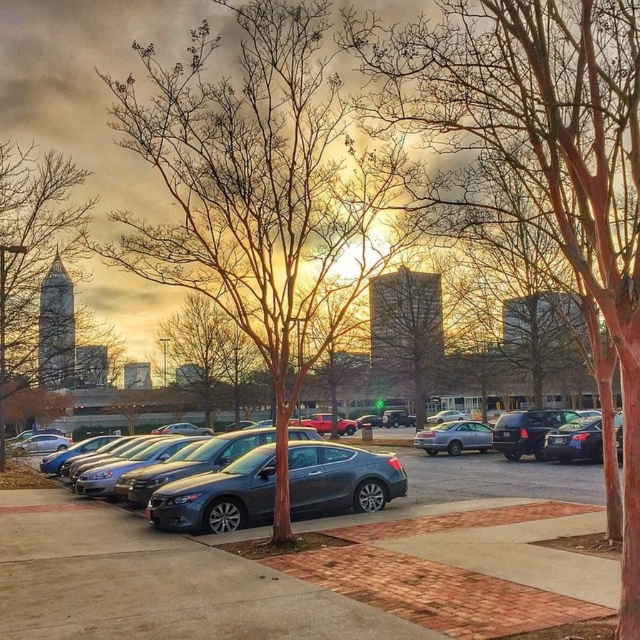
Is brown bark tree at center smaller than satin gray sedan at center?

No, brown bark tree at center is not smaller than satin gray sedan at center.

I want to click on brown bark tree at center, so click(260, 195).

Does smooth brown tree trunk at left have a lesser height compared to satin gray sedan at center?

No.

How far apart are smooth brown tree trunk at left and satin gray sedan at center?

smooth brown tree trunk at left is 15.93 meters from satin gray sedan at center.

Which is in front, point (44, 202) or point (244, 504)?

Positioned in front is point (244, 504).

Where is `smooth brown tree trunk at left`? smooth brown tree trunk at left is located at coordinates (35, 266).

Can you confirm if brown bark tree at center is positioned above shiny black sedan at right?

Yes.

Which is behind, point (356, 330) or point (548, 451)?

Point (356, 330)

The width and height of the screenshot is (640, 640). Identify the location of brown bark tree at center. (260, 195).